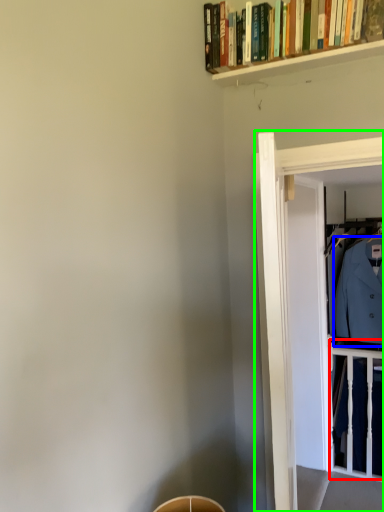
Question: Considering the real-world distances, which object is farthest from balustrade (highlighted by a red box)? dress shirt (highlighted by a blue box) or glass door (highlighted by a green box)?

Choices:
 (A) dress shirt
 (B) glass door

Answer: (B)